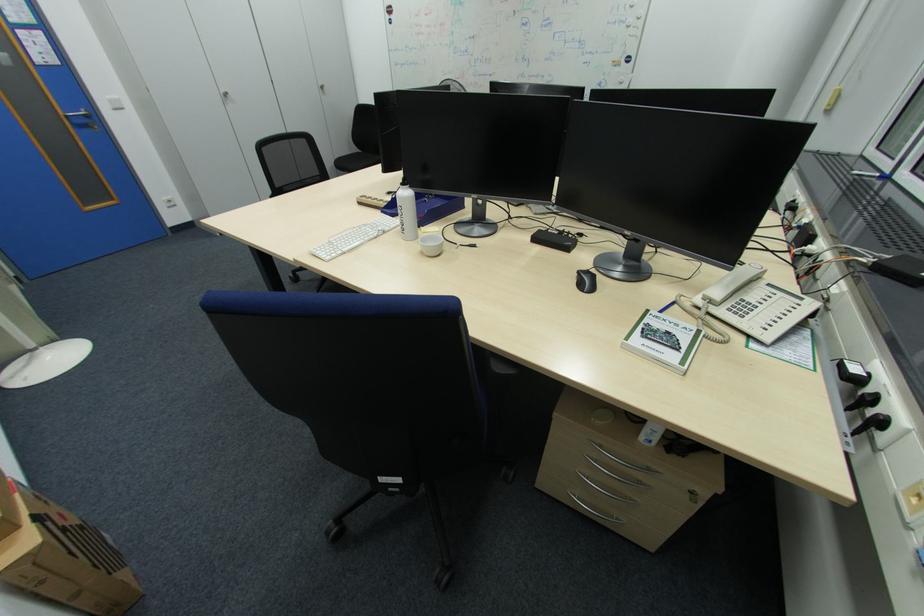
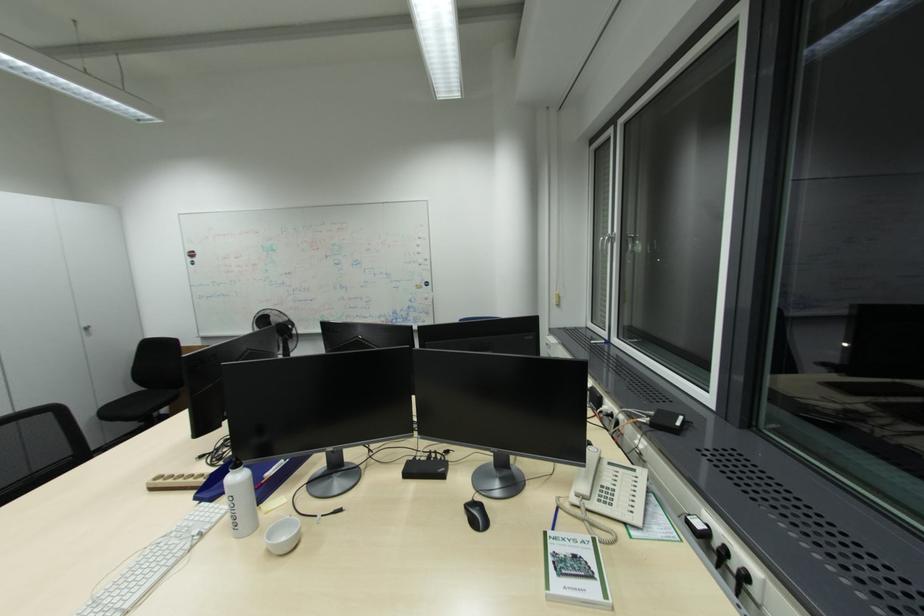
The images are taken continuously from a first-person perspective. In which direction is your viewpoint rotating?

The camera's rotation is toward right-up.